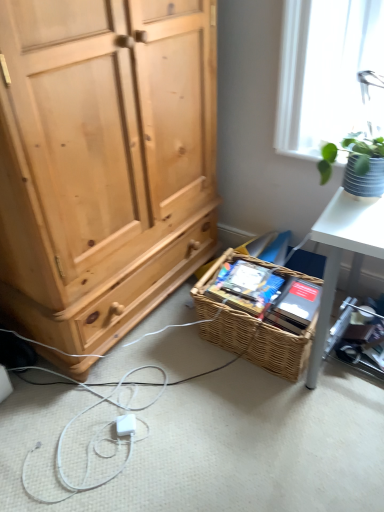
Question: From a real-world perspective, does textured gray pot at upper right sit lower than white plastic desk at right?

Choices:
 (A) no
 (B) yes

Answer: (A)

Question: Considering the relative sizes of textured gray pot at upper right and white plastic desk at right in the image provided, is textured gray pot at upper right taller than white plastic desk at right?

Choices:
 (A) no
 (B) yes

Answer: (A)

Question: Is textured gray pot at upper right touching white plastic desk at right?

Choices:
 (A) no
 (B) yes

Answer: (A)

Question: Can you confirm if textured gray pot at upper right is smaller than white plastic desk at right?

Choices:
 (A) yes
 (B) no

Answer: (A)

Question: From the image's perspective, does textured gray pot at upper right appear lower than white plastic desk at right?

Choices:
 (A) yes
 (B) no

Answer: (B)

Question: Considering the positions of white plastic desk at right and woven brown picnic basket at lower center in the image, is white plastic desk at right taller or shorter than woven brown picnic basket at lower center?

Choices:
 (A) short
 (B) tall

Answer: (A)

Question: From the image's perspective, is white plastic desk at right located above or below woven brown picnic basket at lower center?

Choices:
 (A) above
 (B) below

Answer: (B)

Question: In the image, is white plastic desk at right on the left side or the right side of woven brown picnic basket at lower center?

Choices:
 (A) left
 (B) right

Answer: (B)

Question: Is white plastic desk at right wider or thinner than woven brown picnic basket at lower center?

Choices:
 (A) thin
 (B) wide

Answer: (B)

Question: In terms of width, does white plastic desk at right look wider or thinner when compared to textured gray pot at upper right?

Choices:
 (A) thin
 (B) wide

Answer: (B)

Question: From a real-world perspective, is white plastic desk at right positioned above or below textured gray pot at upper right?

Choices:
 (A) above
 (B) below

Answer: (B)

Question: In the image, is white plastic desk at right on the left side or the right side of textured gray pot at upper right?

Choices:
 (A) right
 (B) left

Answer: (A)

Question: From their relative heights in the image, would you say white plastic desk at right is taller or shorter than textured gray pot at upper right?

Choices:
 (A) tall
 (B) short

Answer: (A)

Question: In the image, is woven brown picnic basket at lower center positioned in front of or behind textured gray pot at upper right?

Choices:
 (A) behind
 (B) front

Answer: (A)

Question: Is woven brown picnic basket at lower center wider or thinner than textured gray pot at upper right?

Choices:
 (A) wide
 (B) thin

Answer: (A)